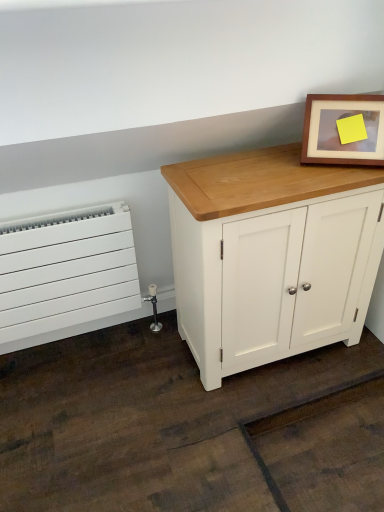
You are a GUI agent. You are given a task and a screenshot of the screen. Output one action in this format:
    pyautogui.click(x=<x>, y=<y>)
    Task: Click on the vacant space situated on the left part of white painted wood cabinet at center
    The width and height of the screenshot is (384, 512).
    Given the screenshot: What is the action you would take?
    pyautogui.click(x=134, y=390)